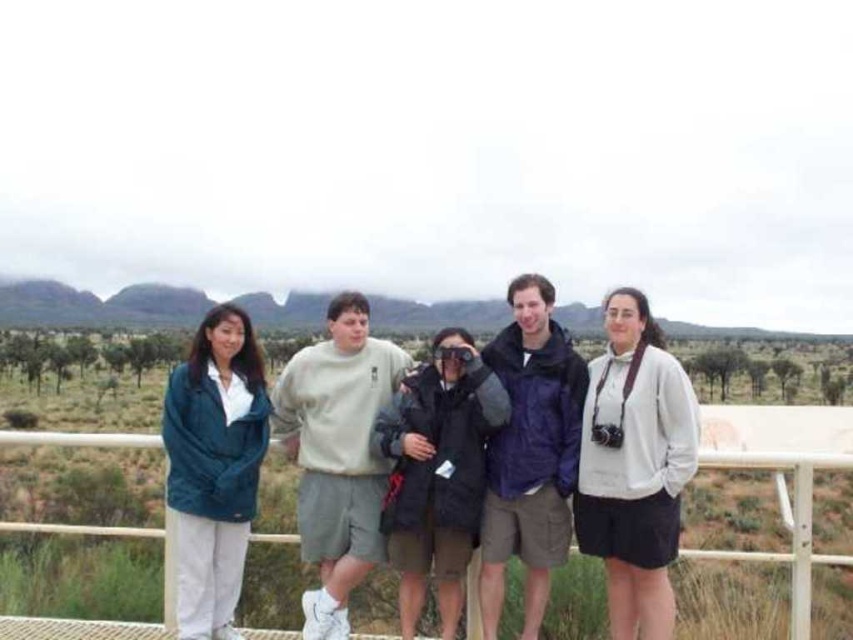
You are a photographer trying to capture a clear shot of the teal fleece jacket at left and the metallic white fence at center. Based on their positions, which object is closer to the camera?

The teal fleece jacket at left is above the metallic white fence at center, meaning it is closer to the camera.

You are standing on the raised platform and want to move from the teal fleece jacket at left to the metallic white fence at center. Which direction should you move to reach it?

The teal fleece jacket at left is to the right of the metallic white fence at center, so you should move to the left to reach the metallic white fence at center.